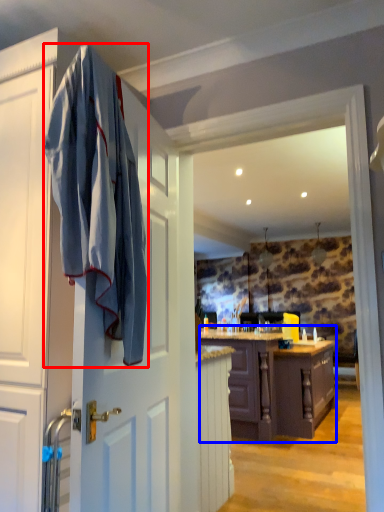
Question: Which object is further to the camera taking this photo, bath towel (highlighted by a red box) or cabinetry (highlighted by a blue box)?

Choices:
 (A) bath towel
 (B) cabinetry

Answer: (B)